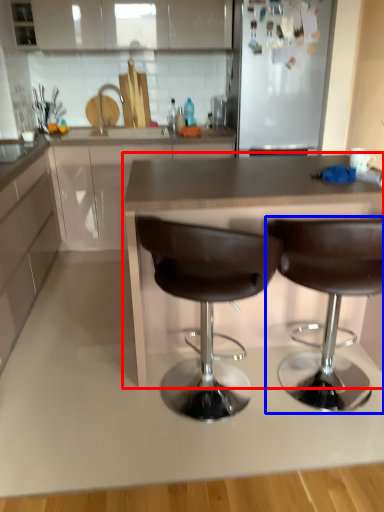
Question: Which of the following is the farthest to the observer, countertop (highlighted by a red box) or chair (highlighted by a blue box)?

Choices:
 (A) countertop
 (B) chair

Answer: (A)